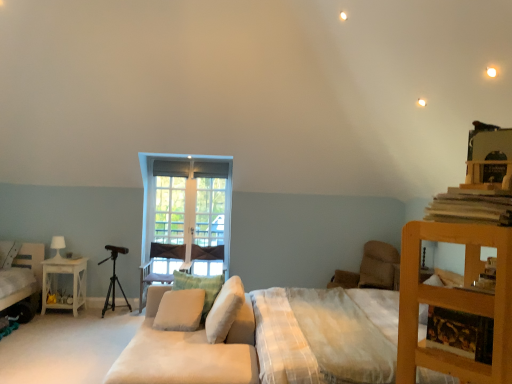
Question: Is white soft cushion at center, the 2th pillow positioned from the left, surrounded by white wooden window at center?

Choices:
 (A) yes
 (B) no

Answer: (B)

Question: Considering the relative sizes of white wooden window at center and white soft cushion at center, the 2th pillow viewed from the front, in the image provided, is white wooden window at center shorter than white soft cushion at center, the 2th pillow viewed from the front,?

Choices:
 (A) yes
 (B) no

Answer: (B)

Question: Does white wooden window at center come in front of white soft cushion at center, the 2th pillow viewed from the front?

Choices:
 (A) yes
 (B) no

Answer: (B)

Question: From a real-world perspective, is white wooden window at center on top of white soft cushion at center, the 2th pillow positioned from the left?

Choices:
 (A) yes
 (B) no

Answer: (A)

Question: Considering the relative sizes of white wooden window at center and white soft cushion at center, which is the 3th pillow from right to left, in the image provided, is white wooden window at center wider than white soft cushion at center, which is the 3th pillow from right to left,?

Choices:
 (A) yes
 (B) no

Answer: (B)

Question: Is white wooden window at center far from white soft cushion at center, the 2th pillow viewed from the front?

Choices:
 (A) no
 (B) yes

Answer: (B)

Question: Is white soft cushion at center, which is counted as the first pillow, starting from the right, far from velvet purple armchair at center, which appears as the second armchair when viewed from the right?

Choices:
 (A) no
 (B) yes

Answer: (B)

Question: From a real-world perspective, is white soft cushion at center, marked as the 4th pillow in a left-to-right arrangement, physically below velvet purple armchair at center, which appears as the second armchair when viewed from the right?

Choices:
 (A) yes
 (B) no

Answer: (B)

Question: Is white soft cushion at center, positioned as the 1th pillow in front-to-back order, with velvet purple armchair at center, the 1th armchair when ordered from left to right?

Choices:
 (A) yes
 (B) no

Answer: (B)

Question: Can you confirm if white soft cushion at center, marked as the 4th pillow in a left-to-right arrangement, is taller than velvet purple armchair at center, which appears as the second armchair when viewed from the right?

Choices:
 (A) no
 (B) yes

Answer: (A)

Question: Is white soft cushion at center, positioned as the 1th pillow in front-to-back order, at the right side of velvet purple armchair at center, the 1th armchair when ordered from left to right?

Choices:
 (A) no
 (B) yes

Answer: (B)

Question: Is white soft cushion at center, which is counted as the first pillow, starting from the right, at the left side of velvet purple armchair at center, the 1th armchair when ordered from left to right?

Choices:
 (A) yes
 (B) no

Answer: (B)

Question: Is there a large distance between wooden tripod at left and beige fabric pillow at center, the third pillow positioned from the front?

Choices:
 (A) no
 (B) yes

Answer: (B)